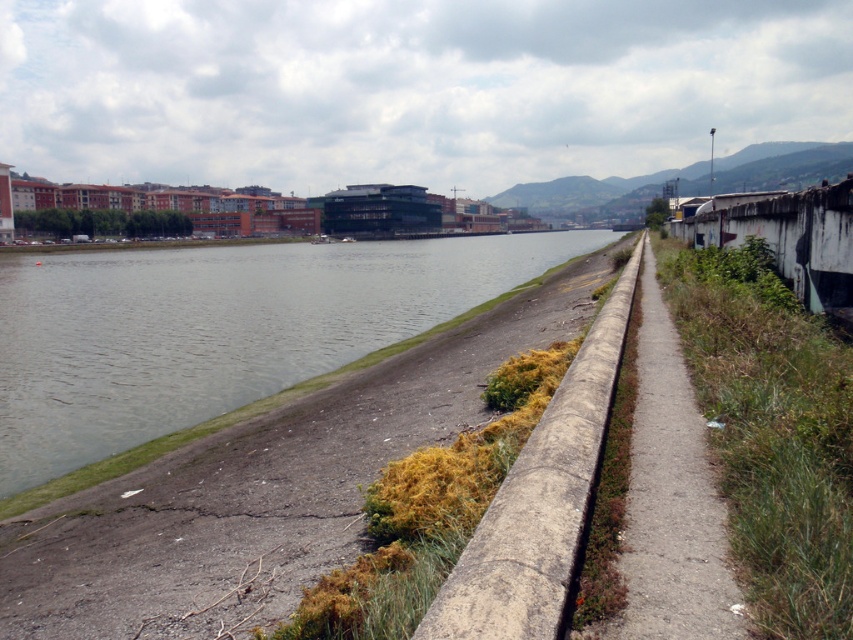
Question: Is concrete at right closer to the viewer compared to concrete at center?

Choices:
 (A) no
 (B) yes

Answer: (A)

Question: Which object is positioned closest to the concrete at center?

Choices:
 (A) concrete at right
 (B) green concrete river at center

Answer: (A)

Question: Considering the real-world distances, which object is farthest from the green concrete river at center?

Choices:
 (A) concrete at center
 (B) concrete at right

Answer: (B)

Question: Can you confirm if green concrete river at center is bigger than concrete at center?

Choices:
 (A) no
 (B) yes

Answer: (B)

Question: Does concrete at right have a smaller size compared to concrete at center?

Choices:
 (A) yes
 (B) no

Answer: (A)

Question: Which object is farther from the camera taking this photo?

Choices:
 (A) green concrete river at center
 (B) concrete at center

Answer: (A)